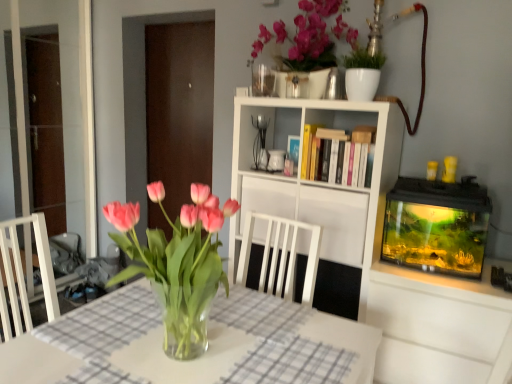
Locate an element on the screen. The width and height of the screenshot is (512, 384). free space above transparent glass door at center, the 2th glass door from the left (from a real-world perspective) is located at coordinates (192, 20).